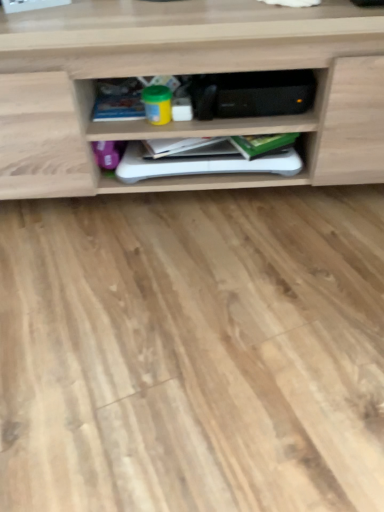
What are the coordinates of `free space in front of wooden shelf at center` in the screenshot? It's located at (194, 312).